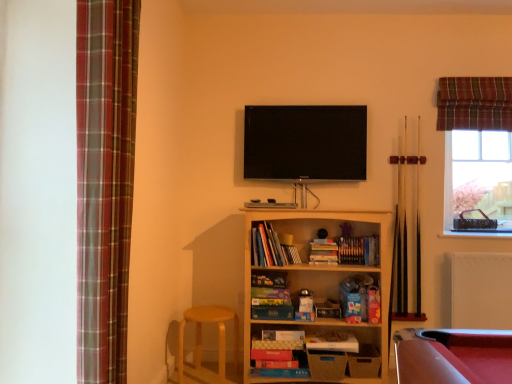
The width and height of the screenshot is (512, 384). Identify the location of vacant space underneath plaid fabric curtain at upper right, the first curtain viewed from the back (from a real-world perspective). (463, 244).